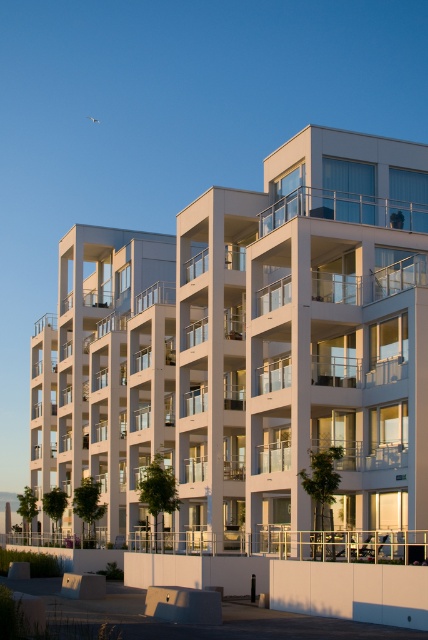
You are standing in front of the white smooth building at center and want to locate the clear glass balcony at upper center. Based on the scene, which direction should you turn to find it?

The white smooth building at center is to the left of clear glass balcony at upper center, so you should turn to your right to locate it.

You are standing in front of the modern residential building and want to take a photo. You notice two points on the building facade marked as point 1 at coordinates [321,518] and point 2 at coordinates [419,216]. Which point will appear larger in your photo?

Point 1 at coordinates [321,518] will appear larger in the photo because it is closer to the camera than point 2 at coordinates [419,216].

You are standing on the sidewalk in front of the white smooth building at center and want to look up at the clear glass balcony at upper center. Is the balcony above or below the building?

The clear glass balcony at upper center is positioned above the white smooth building at center, so the balcony is above the building.